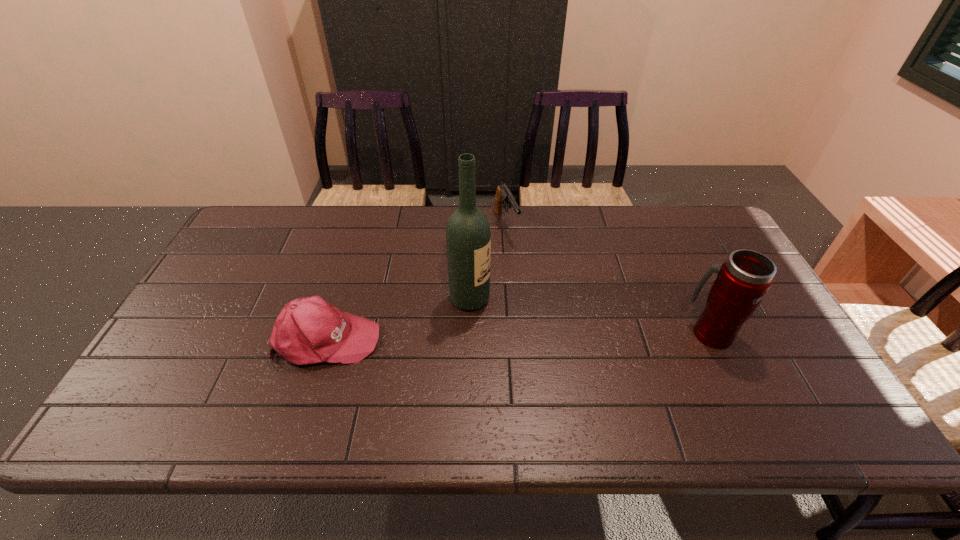
Find the location of a particular element. The height and width of the screenshot is (540, 960). free space located on the side with the handle of the thermos bottle is located at coordinates [640, 333].

Find the location of a particular element. free point located 0.190m on the labeled side of the second object from left to right is located at coordinates (552, 333).

The width and height of the screenshot is (960, 540). I want to click on vacant space located 0.300m on the labeled side of the second object from left to right, so click(592, 349).

I want to click on vacant region located 0.280m on the labeled side of the second object from left to right, so click(585, 346).

You are a GUI agent. You are given a task and a screenshot of the screen. Output one action in this format:
    pyautogui.click(x=<x>, y=<y>)
    Task: Click on the free space located 0.240m along the barrel of the second object from right to left
    
    Given the screenshot: What is the action you would take?
    pyautogui.click(x=538, y=296)

The height and width of the screenshot is (540, 960). I want to click on free space located 0.220m along the barrel of the second object from right to left, so click(535, 292).

Find the location of a particular element. The image size is (960, 540). free point located 0.260m along the barrel of the second object from right to left is located at coordinates (x=540, y=301).

Locate an element on the screen. The width and height of the screenshot is (960, 540). object present at the far edge is located at coordinates (503, 195).

Where is `object that is positioned at the near edge`? object that is positioned at the near edge is located at coordinates (309, 330).

Find the location of a particular element. The image size is (960, 540). object located at the right edge is located at coordinates (744, 278).